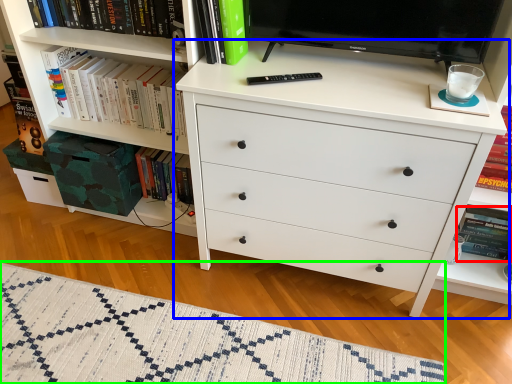
Question: Estimate the real-world distances between objects in this image. Which object is farther from paperback book (highlighted by a red box), chest of drawers (highlighted by a blue box) or blanket (highlighted by a green box)?

Choices:
 (A) chest of drawers
 (B) blanket

Answer: (B)